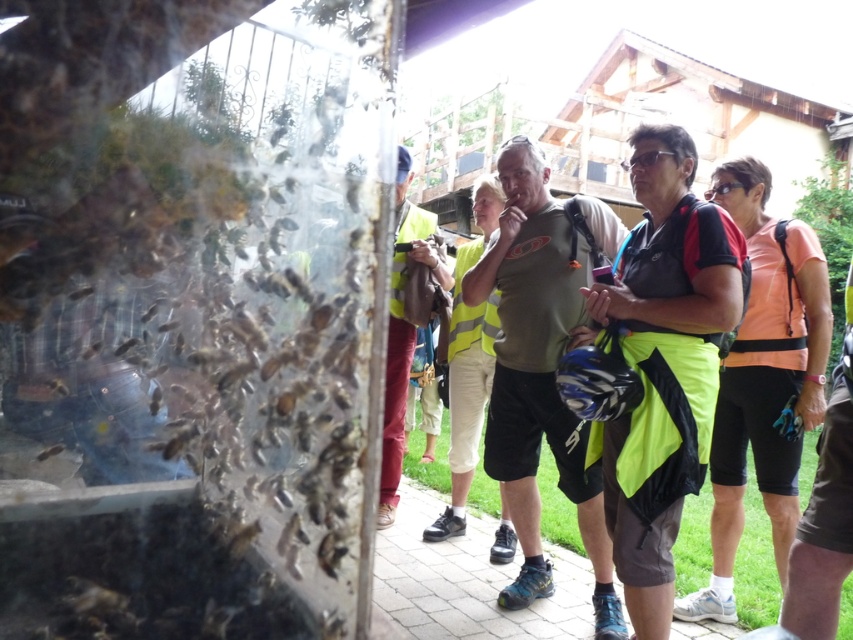
Question: In this image, where is yellow reflective vest at center located relative to black matte sunglasses at center?

Choices:
 (A) right
 (B) left

Answer: (B)

Question: In this image, where is matte green t-shirt at center located relative to black plastic goggles at center?

Choices:
 (A) below
 (B) above

Answer: (A)

Question: Which object appears farthest from the camera in this image?

Choices:
 (A) black plastic goggles at center
 (B) black matte sunglasses at center
 (C) yellow reflective vest at center
 (D) matte green t-shirt at center

Answer: (C)

Question: Which point appears farthest from the camera in this image?

Choices:
 (A) (677, 160)
 (B) (399, 433)

Answer: (B)

Question: Considering the real-world distances, which object is farthest from the yellow reflective vest at center?

Choices:
 (A) black matte shorts at center
 (B) black matte sunglasses at center
 (C) black plastic goggles at center

Answer: (C)

Question: Is matte green t-shirt at center further to camera compared to black plastic goggles at center?

Choices:
 (A) no
 (B) yes

Answer: (A)